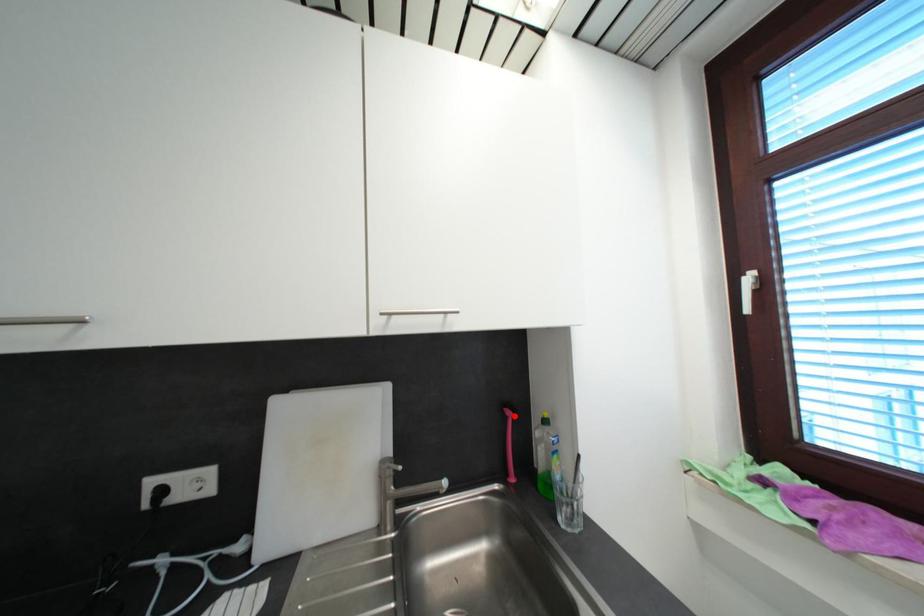
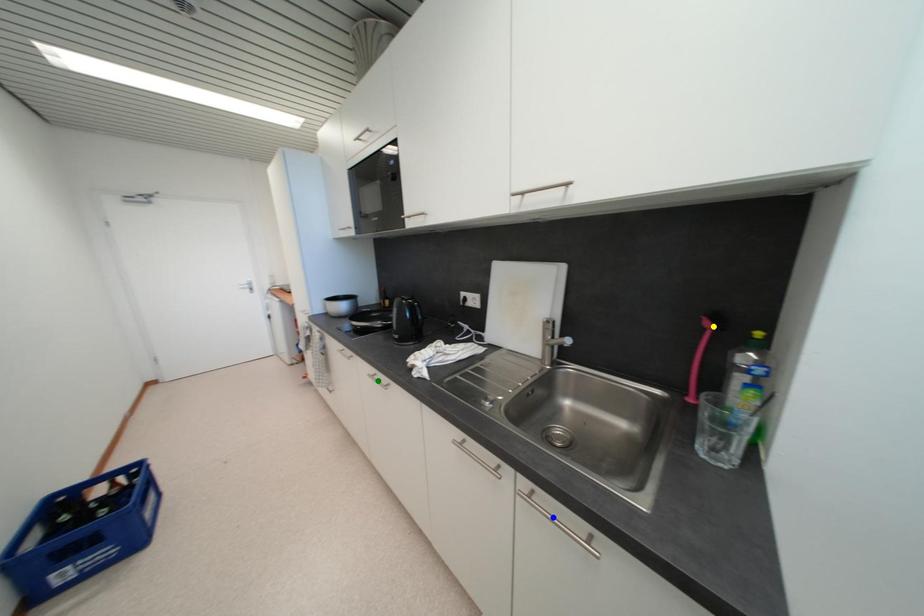
Question: I am providing you with two images of the same scene from different viewpoints. A red point is marked on the first image. You are given multiple points on the second image. In image 2, which mark is for the same physical point as the one in image 1?

Choices:
 (A) yellow point
 (B) green point
 (C) blue point

Answer: (A)